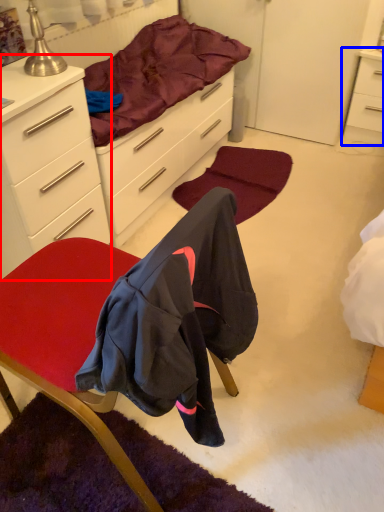
Question: Which object is further to the camera taking this photo, cabinetry (highlighted by a red box) or nightstand (highlighted by a blue box)?

Choices:
 (A) cabinetry
 (B) nightstand

Answer: (B)